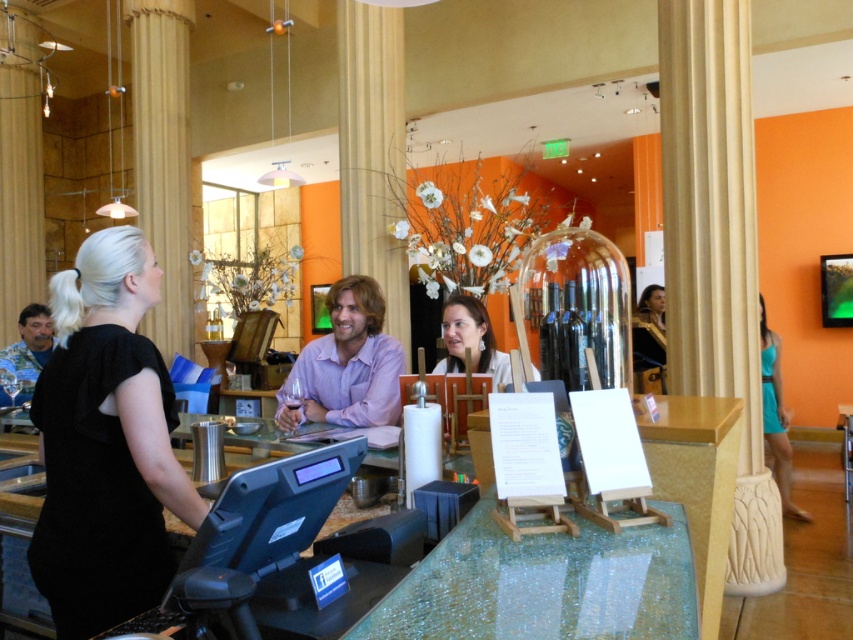
At what (x,y) coordinates should I click in order to perform the action: click on purple cotton shirt at center. Please return your answer as a coordinate pair (x, y). Looking at the image, I should click on (351, 360).

Can you confirm if purple cotton shirt at center is smaller than teal fabric dress at right?

Yes, purple cotton shirt at center is smaller than teal fabric dress at right.

Is point (340, 419) behind point (784, 433)?

No, it is in front of (784, 433).

This screenshot has height=640, width=853. Identify the location of purple cotton shirt at center. (351, 360).

Which is more to the left, purple cotton shirt at center or camouflage fabric shirt at left?

Positioned to the left is camouflage fabric shirt at left.

Between point (347, 330) and point (33, 376), which one is positioned in front?

Point (347, 330)

Locate an element on the screen. purple cotton shirt at center is located at coordinates (351, 360).

Is black matte dress at left closer to the viewer compared to matte white blouse at center?

Yes, black matte dress at left is closer to the viewer.

Is black matte dress at left thinner than matte white blouse at center?

Incorrect, black matte dress at left's width is not less than matte white blouse at center's.

Between point (189, 524) and point (457, 353), which one is positioned in front?

Point (189, 524) is more forward.

This screenshot has height=640, width=853. I want to click on black matte dress at left, so click(106, 444).